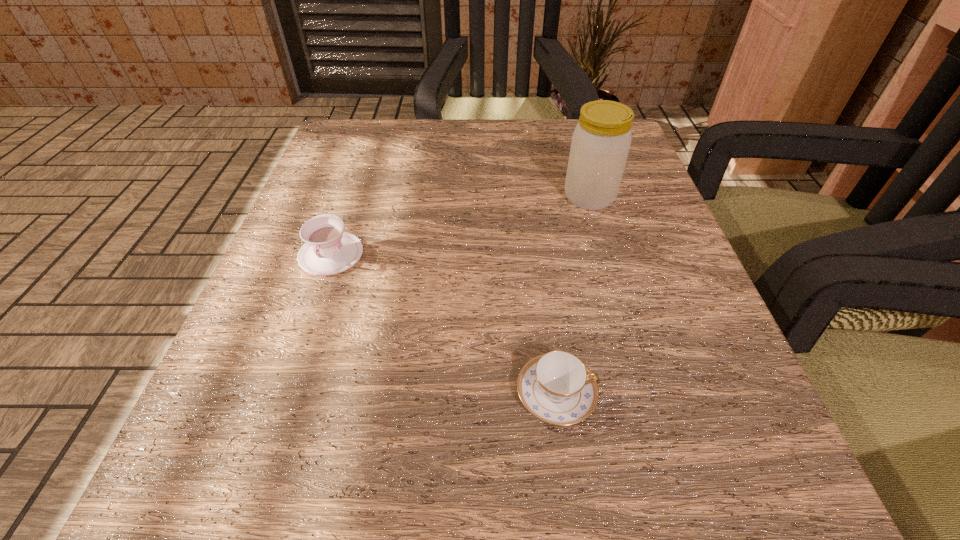
Identify the location of jar. (600, 144).

At what (x,y) coordinates should I click in order to perform the action: click on the tallest object. Please return your answer as a coordinate pair (x, y). The image size is (960, 540). Looking at the image, I should click on (600, 144).

Locate an element on the screen. The height and width of the screenshot is (540, 960). the leftmost object is located at coordinates (328, 250).

Identify the location of the left teacup. (328, 250).

You are a GUI agent. You are given a task and a screenshot of the screen. Output one action in this format:
    pyautogui.click(x=<x>, y=<y>)
    Task: Click on the nearest object
    
    Given the screenshot: What is the action you would take?
    pyautogui.click(x=556, y=387)

Locate an element on the screen. The height and width of the screenshot is (540, 960). the nearer teacup is located at coordinates (556, 387).

Where is `vacant space located 0.140m on the back of the farthest object`? The height and width of the screenshot is (540, 960). vacant space located 0.140m on the back of the farthest object is located at coordinates (574, 144).

You are a GUI agent. You are given a task and a screenshot of the screen. Output one action in this format:
    pyautogui.click(x=<x>, y=<y>)
    Task: Click on the vacant space located on the handle side of the second farthest object
    The image size is (960, 540).
    Given the screenshot: What is the action you would take?
    pyautogui.click(x=252, y=487)

Where is `vacant area situated on the side with the handle of the nearer teacup`? This screenshot has width=960, height=540. vacant area situated on the side with the handle of the nearer teacup is located at coordinates (721, 394).

Find the location of a particular element. object positioned at the left edge is located at coordinates (328, 250).